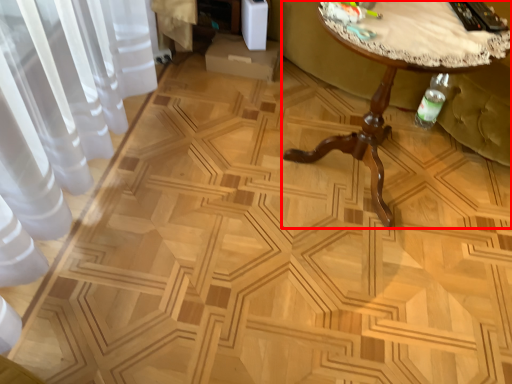
Question: In this image, where is table (annotated by the red box) located relative to swivel chair?

Choices:
 (A) left
 (B) right

Answer: (A)